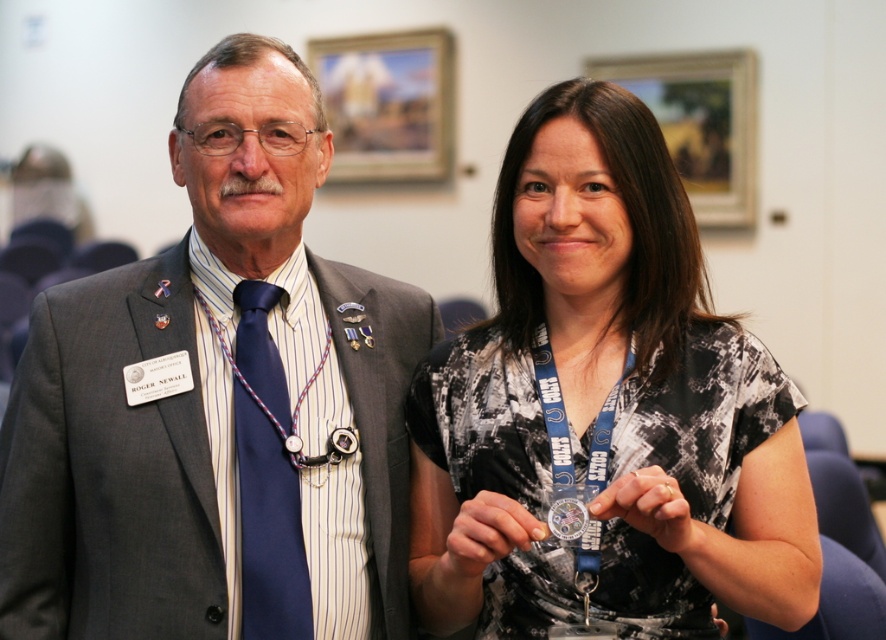
You are a photographer at the event. You need to adjust your camera focus to capture the point at coordinate point (364, 534) which is 1.52 meters away. What is the minimum distance your camera should be set to focus on to ensure the point is in sharp focus?

The camera should be set to focus at least 1.52 meters away to ensure the point at coordinate point (364, 534) is in sharp focus.

You are organizing a photo shoot and need to position the matte gray suit at center and the printed fabric shirt at center according to their original positions. From the photographer standing at the back of the room, which one is closer to the left side?

The matte gray suit at center is to the left of the printed fabric shirt at center, so from the photographer standing at the back of the room, the matte gray suit at center is closer to the left side.